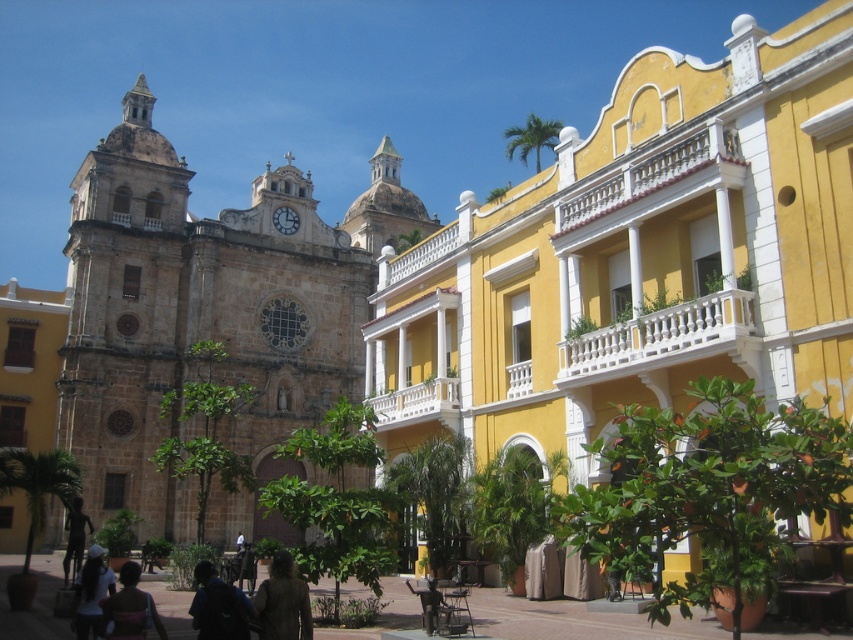
You are a delivery person trying to navigate between the historic stone church on the left and the bright yellow colonial building on the right. You need to place a package on the bronze statue at lower left. However, there is a dark brown leather jacket at lower center in the way. Can you move the jacket to access the statue?

The dark brown leather jacket at lower center is located above the bronze statue at lower left. To access the statue, you would need to move the jacket downward from its current position above the statue.

You are a city planner assessing the width of buildings for a new pedestrian walkway. You observe the matte stone church at center and the white cotton shirt at lower left. Which of these two objects is wider?

The matte stone church at center is wider than the white cotton shirt at lower left according to the description.

You are a tourist standing in the middle of the street looking at the scene. You see the brown stone church at left and the dark brown leather jacket at lower center. Which object is closer to you?

The dark brown leather jacket at lower center is behind the brown stone church at left, so the brown stone church at left is closer to you.